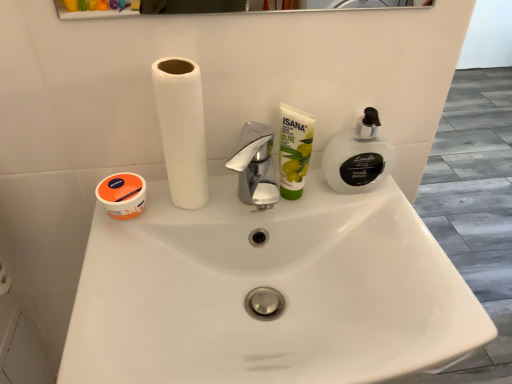
Question: From a real-world perspective, is green matte olive oil cream at center located higher than white translucent pump at right?

Choices:
 (A) no
 (B) yes

Answer: (B)

Question: Does green matte olive oil cream at center have a greater height compared to white translucent pump at right?

Choices:
 (A) no
 (B) yes

Answer: (B)

Question: Does green matte olive oil cream at center have a lesser height compared to white translucent pump at right?

Choices:
 (A) no
 (B) yes

Answer: (A)

Question: Are green matte olive oil cream at center and white translucent pump at right far apart?

Choices:
 (A) yes
 (B) no

Answer: (B)

Question: Is green matte olive oil cream at center oriented towards white translucent pump at right?

Choices:
 (A) no
 (B) yes

Answer: (A)

Question: Can you confirm if green matte olive oil cream at center is smaller than white translucent pump at right?

Choices:
 (A) yes
 (B) no

Answer: (A)

Question: Does white matte paper towel at center have a smaller size compared to white glossy sink at center?

Choices:
 (A) no
 (B) yes

Answer: (B)

Question: Considering the relative positions of white matte paper towel at center and white glossy sink at center in the image provided, is white matte paper towel at center behind white glossy sink at center?

Choices:
 (A) no
 (B) yes

Answer: (B)

Question: From a real-world perspective, is white matte paper towel at center physically above white glossy sink at center?

Choices:
 (A) yes
 (B) no

Answer: (A)

Question: Is white matte paper towel at center not inside white glossy sink at center?

Choices:
 (A) no
 (B) yes

Answer: (B)

Question: Is white matte paper towel at center at the left side of white glossy sink at center?

Choices:
 (A) yes
 (B) no

Answer: (A)

Question: Is white glossy sink at center surrounded by white matte paper towel at center?

Choices:
 (A) no
 (B) yes

Answer: (A)

Question: From the image's perspective, does white matte paper towel at center appear higher than white translucent pump at right?

Choices:
 (A) no
 (B) yes

Answer: (B)